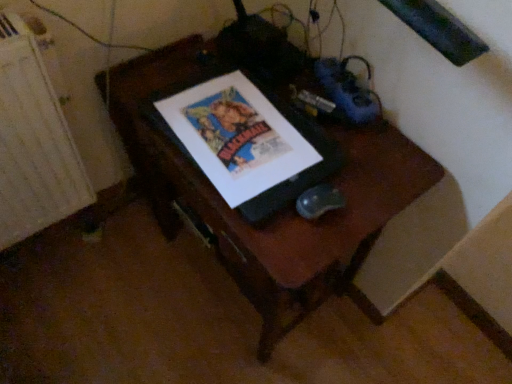
Question: Is white textured radiator at left taller or shorter than matte paper poster at center?

Choices:
 (A) short
 (B) tall

Answer: (B)

Question: Looking at the image, does white textured radiator at left seem bigger or smaller compared to matte paper poster at center?

Choices:
 (A) big
 (B) small

Answer: (A)

Question: Based on their relative distances, which object is farther from the white textured radiator at left?

Choices:
 (A) matte paper poster at center
 (B) wooden desk at center

Answer: (A)

Question: Which object is positioned farthest from the wooden desk at center?

Choices:
 (A) white textured radiator at left
 (B) matte paper poster at center

Answer: (A)